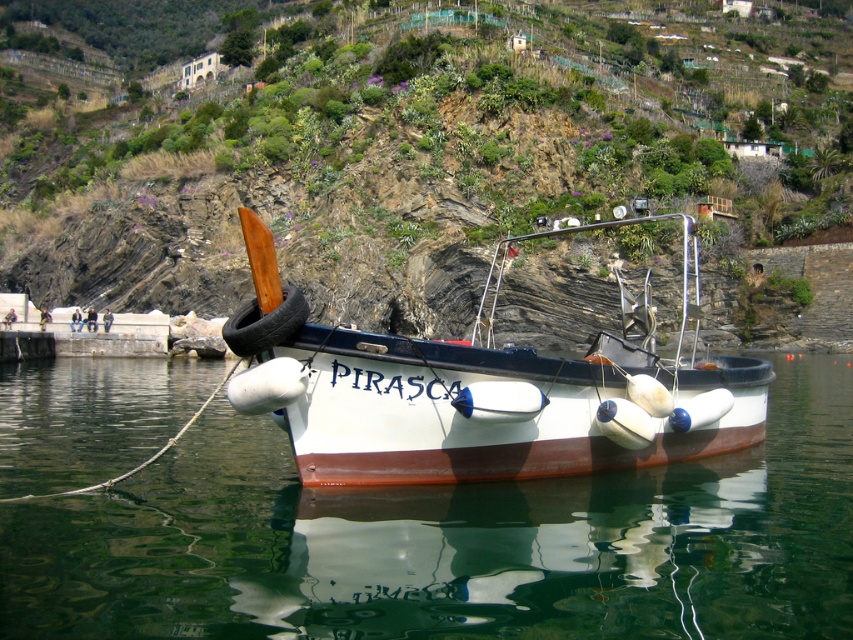
Does green grassy hillside at upper center appear on the left side of transparent water at center?

In fact, green grassy hillside at upper center is to the right of transparent water at center.

Does green grassy hillside at upper center lie behind transparent water at center?

Yes, green grassy hillside at upper center is behind transparent water at center.

Where is `green grassy hillside at upper center`? green grassy hillside at upper center is located at coordinates (421, 148).

Between point (704, 44) and point (606, 410), which one is positioned behind?

Point (704, 44)

Does green grassy hillside at upper center come in front of white matte fishing boat at center?

That is False.

Who is more forward, (x=436, y=241) or (x=668, y=458)?

Point (x=668, y=458)

At what (x,y) coordinates should I click in order to perform the action: click on green grassy hillside at upper center. Please return your answer as a coordinate pair (x, y). This screenshot has height=640, width=853. Looking at the image, I should click on (421, 148).

Does point (782, 579) come in front of point (645, 308)?

Yes.

Is point (740, 554) more distant than point (317, 397)?

No, (740, 554) is in front of (317, 397).

Image resolution: width=853 pixels, height=640 pixels. What are the coordinates of `transparent water at center` in the screenshot? It's located at (451, 541).